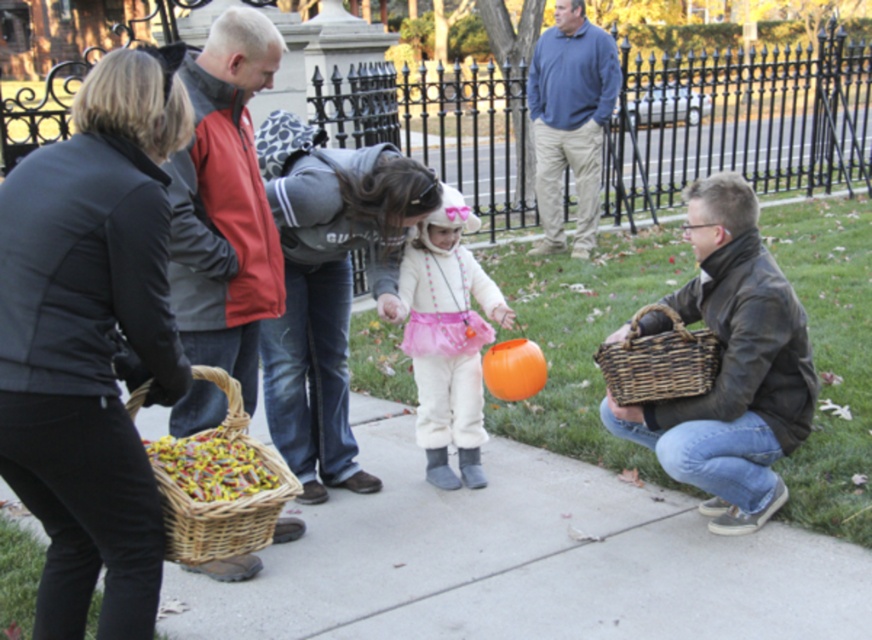
Question: Which point is closer to the camera taking this photo?

Choices:
 (A) (404, 260)
 (B) (596, 44)
 (C) (781, 342)

Answer: (C)

Question: Estimate the real-world distances between objects in this image. Which object is closer to the orange matte pumpkin at center?

Choices:
 (A) woven brown basket at lower right
 (B) brown wicker basket at right
 (C) red jacket at center
 (D) woven brown basket at lower left

Answer: (A)

Question: Which point is closer to the camera taking this photo?

Choices:
 (A) (698, 346)
 (B) (312, 525)

Answer: (A)

Question: Does blue cotton shirt at upper right appear under orange matte pumpkin at center?

Choices:
 (A) yes
 (B) no

Answer: (B)

Question: Does smooth concrete sidewalk at center appear on the right side of white fluffy costume at center?

Choices:
 (A) no
 (B) yes

Answer: (B)

Question: Does white fluffy costume at center come behind woven brown basket at lower right?

Choices:
 (A) yes
 (B) no

Answer: (A)